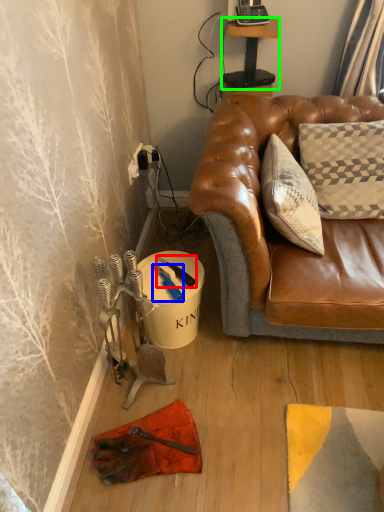
Question: Based on their relative distances, which object is farther from tool (highlighted by a red box)? Choose from tool (highlighted by a blue box) and table (highlighted by a green box).

Choices:
 (A) tool
 (B) table

Answer: (B)